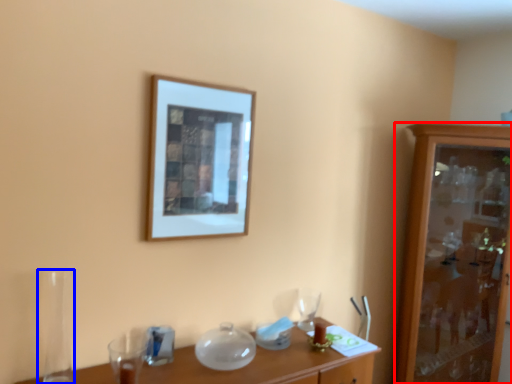
Question: Which object appears closest to the camera in this image, cabinetry (highlighted by a red box) or glass vase (highlighted by a blue box)?

Choices:
 (A) cabinetry
 (B) glass vase

Answer: (B)